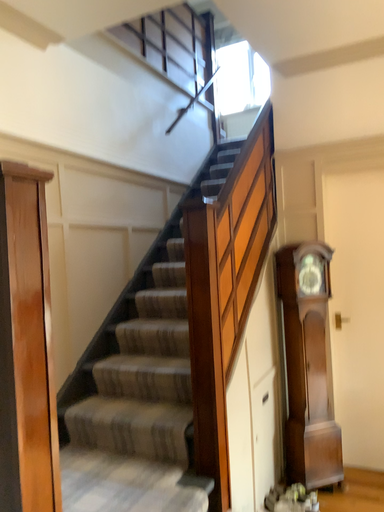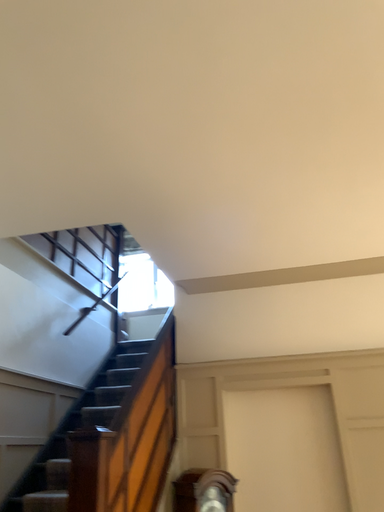
Question: Which way did the camera rotate in the video?

Choices:
 (A) rotated left
 (B) rotated right

Answer: (B)